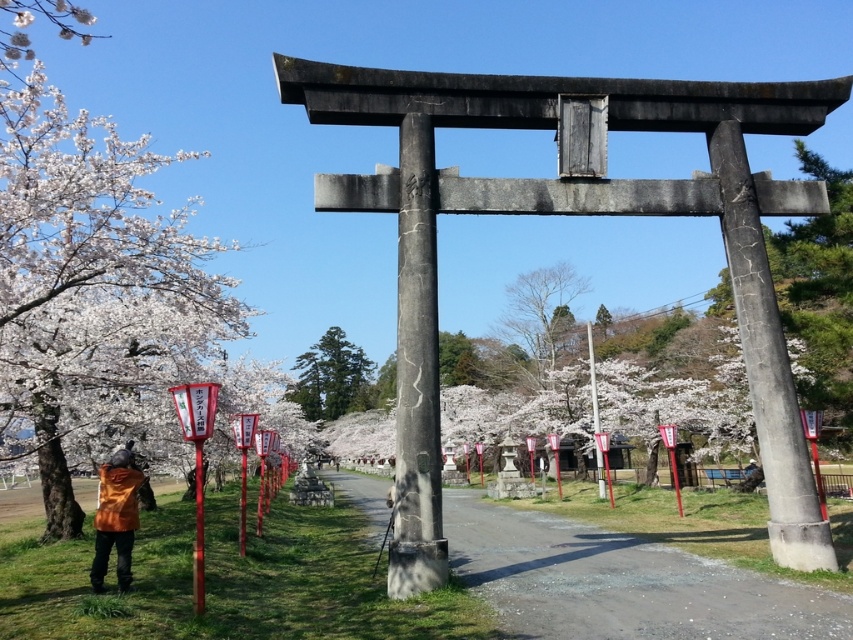
You are a visitor approaching the torii gate at the Japanese shrine. You notice the white blossoms at left and the bare wood tree at center. Which of these two objects is taller?

The white blossoms at left is much taller than the bare wood tree at center.

You are standing at the entrance of the shrine and want to walk towards the torii gate. According to the image, where exactly is the smooth asphalt path at center located?

The smooth asphalt path at center is located at point (x=621, y=582).